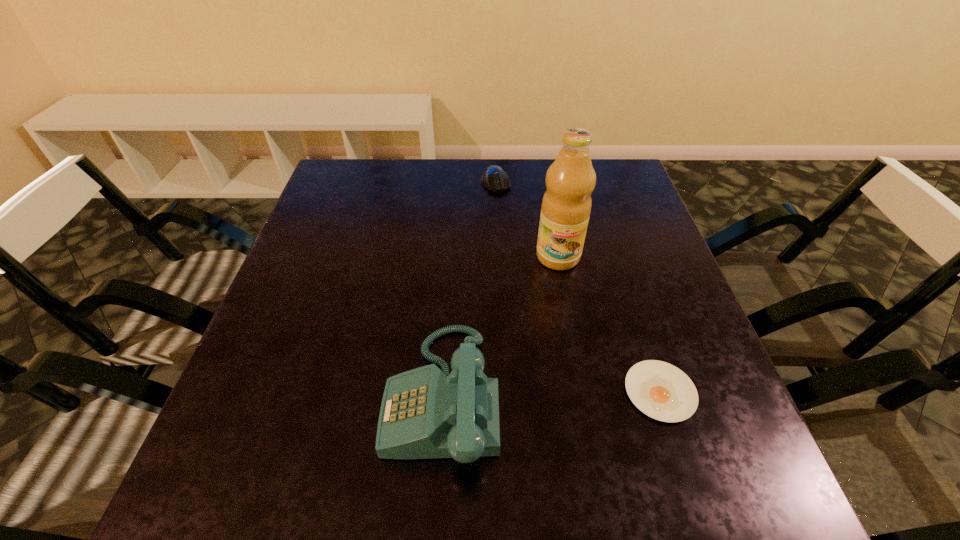
Where is `free space between the shortest object and the third object from left to right`? free space between the shortest object and the third object from left to right is located at coordinates (609, 324).

You are a GUI agent. You are given a task and a screenshot of the screen. Output one action in this format:
    pyautogui.click(x=<x>, y=<y>)
    Task: Click on the empty space between the computer mouse and the olive oil
    This screenshot has height=540, width=960.
    Given the screenshot: What is the action you would take?
    pyautogui.click(x=527, y=219)

In order to click on free space between the third tallest object and the egg yolk in this screenshot , I will do `click(578, 287)`.

At what (x,y) coordinates should I click in order to perform the action: click on free space between the telephone and the rightmost object. Please return your answer as a coordinate pair (x, y). The width and height of the screenshot is (960, 540). Looking at the image, I should click on (551, 393).

Find the location of a particular element. This screenshot has height=540, width=960. free spot between the computer mouse and the second farthest object is located at coordinates (527, 219).

At what (x,y) coordinates should I click in order to perform the action: click on free space between the third shortest object and the second object from right to left. Please return your answer as a coordinate pair (x, y). This screenshot has height=540, width=960. Looking at the image, I should click on (500, 326).

Where is `empty space that is in between the tallest object and the third shortest object`? Image resolution: width=960 pixels, height=540 pixels. empty space that is in between the tallest object and the third shortest object is located at coordinates (500, 326).

Identify the location of vacant point located between the tallest object and the egg yolk. The height and width of the screenshot is (540, 960). (609, 324).

I want to click on object identified as the closest to the second shortest object, so click(x=566, y=205).

Identify which object is located as the nearest to the telephone. Please provide its 2D coordinates. Your answer should be formatted as a tuple, i.e. [(x, y)], where the tuple contains the x and y coordinates of a point satisfying the conditions above.

[(566, 205)]